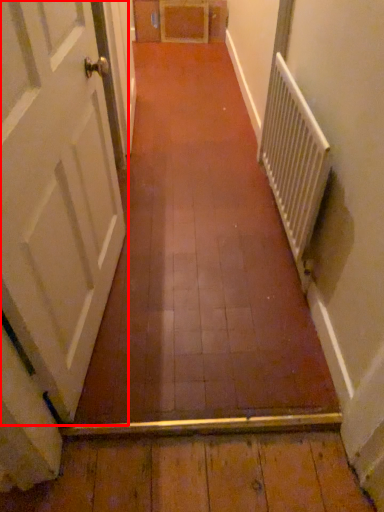
Question: Considering the relative positions of door (annotated by the red box) and radiator in the image provided, where is door (annotated by the red box) located with respect to the staircase?

Choices:
 (A) right
 (B) left

Answer: (B)